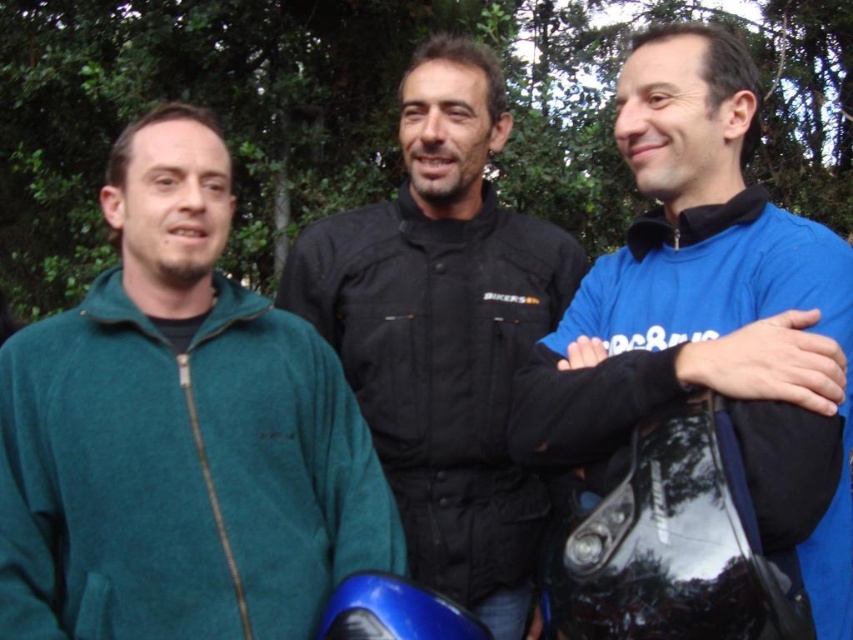
Question: Does teal fleece jacket at left have a lesser width compared to blue fleece jacket at center?

Choices:
 (A) no
 (B) yes

Answer: (A)

Question: Based on their relative distances, which object is farther from the teal fleece jacket at left?

Choices:
 (A) blue fleece jacket at center
 (B) black matte jacket at center

Answer: (A)

Question: Is black matte jacket at center wider than blue fleece jacket at center?

Choices:
 (A) yes
 (B) no

Answer: (A)

Question: Which point appears closest to the camera in this image?

Choices:
 (A) (201, 268)
 (B) (848, 592)
 (C) (538, 307)

Answer: (B)

Question: Which of the following is the farthest from the observer?

Choices:
 (A) (685, 193)
 (B) (283, 378)

Answer: (B)

Question: Does teal fleece jacket at left have a larger size compared to blue fleece jacket at center?

Choices:
 (A) yes
 (B) no

Answer: (B)